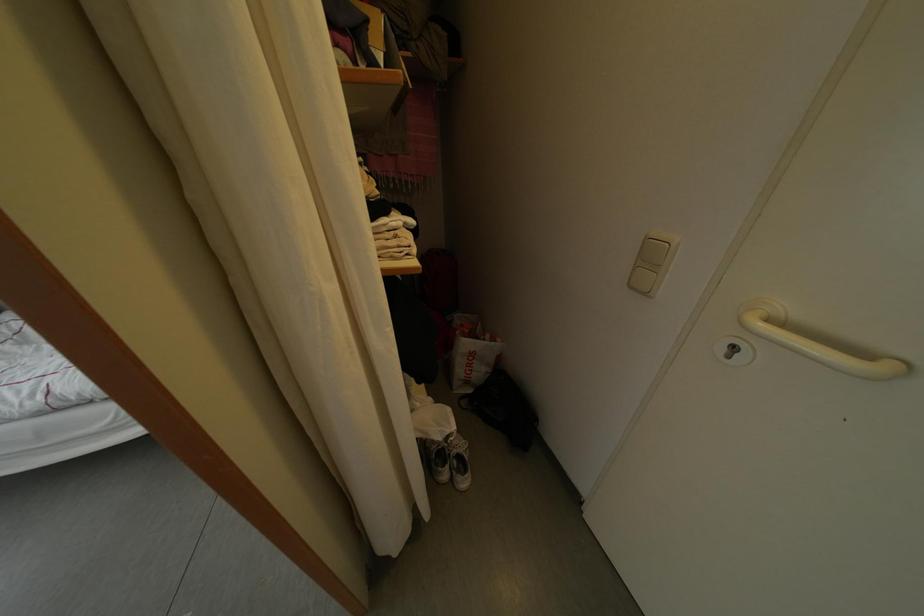
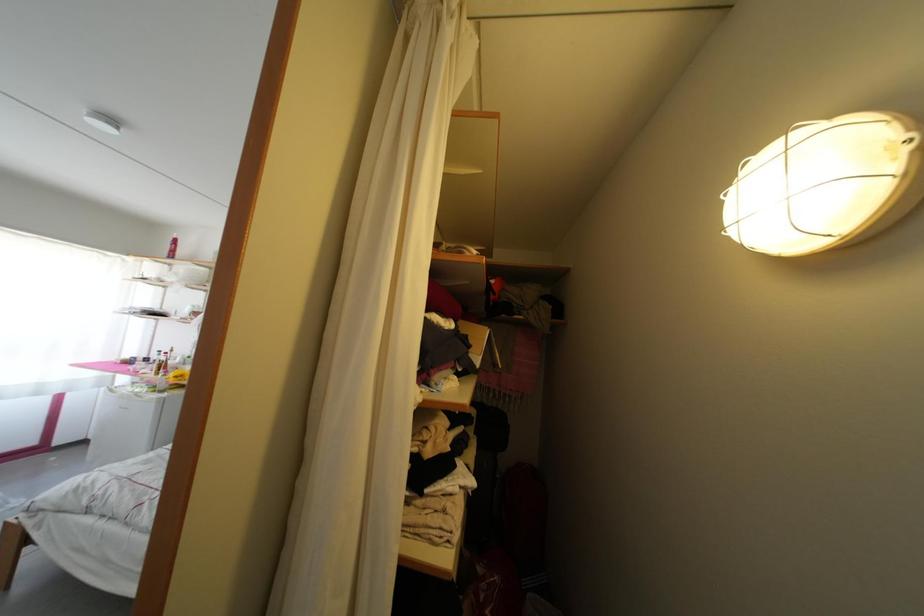
How did the camera likely rotate?

The camera rotated toward left-up.